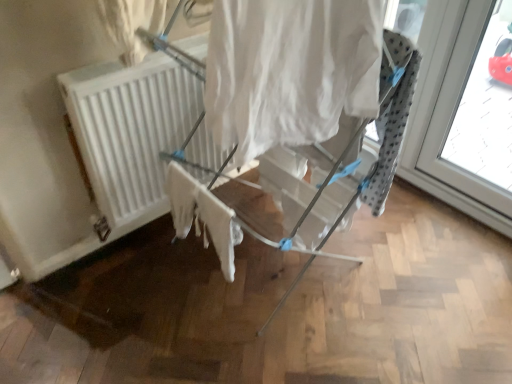
Measure the distance between white fabric curtain at center and camera.

white fabric curtain at center is 25.12 inches from camera.

Locate an element on the screen. The image size is (512, 384). white fabric curtain at center is located at coordinates (290, 70).

You are a GUI agent. You are given a task and a screenshot of the screen. Output one action in this format:
    pyautogui.click(x=<x>, y=<y>)
    Task: Click on the transparent glass window at right
    This screenshot has width=512, height=384.
    Given the screenshot: What is the action you would take?
    pyautogui.click(x=455, y=113)

Describe the element at coordinates (383, 135) in the screenshot. This screenshot has height=384, width=512. I see `white fabric drying rack at center` at that location.

At what (x,y) coordinates should I click in order to perform the action: click on white fabric drying rack at center. Please return your answer as a coordinate pair (x, y). Looking at the image, I should click on (383, 135).

At what (x,y) coordinates should I click in order to perform the action: click on white fabric curtain at center. Please return your answer as a coordinate pair (x, y). This screenshot has width=512, height=384. Looking at the image, I should click on (290, 70).

Considering the sizes of objects white fabric curtain at center and white fabric drying rack at center in the image provided, who is wider, white fabric curtain at center or white fabric drying rack at center?

Wider between the two is white fabric drying rack at center.

Is white fabric curtain at center further to the viewer compared to white fabric drying rack at center?

That is False.

Are white fabric curtain at center and white fabric drying rack at center far apart?

No, white fabric curtain at center is not far from white fabric drying rack at center.

From a real-world perspective, which object rests below the other?

From a 3D spatial view, white fabric drying rack at center is below.

Which of these two, white fabric drying rack at center or transparent glass window at right, is bigger?

Bigger between the two is white fabric drying rack at center.

In the scene shown: Considering their positions, is white fabric drying rack at center located in front of or behind transparent glass window at right?

Clearly, white fabric drying rack at center is in front of transparent glass window at right.

How different are the orientations of white fabric drying rack at center and transparent glass window at right in degrees?

The angle between the facing direction of white fabric drying rack at center and the facing direction of transparent glass window at right is 89.3 degrees.

Consider the image. Is white fabric drying rack at center beside transparent glass window at right?

white fabric drying rack at center is not next to transparent glass window at right, and they're not touching.

From the image's perspective, is white matte radiator at center over white cotton cloth at center?

Yes, from the image's perspective, white matte radiator at center is above white cotton cloth at center.

Looking at their sizes, would you say white matte radiator at center is wider or thinner than white cotton cloth at center?

In the image, white matte radiator at center appears to be more narrow than white cotton cloth at center.

Choose the correct answer: Is white matte radiator at center inside white cotton cloth at center or outside it?

white matte radiator at center is spatially situated outside white cotton cloth at center.

Who is bigger, white matte radiator at center or white cotton cloth at center?

white matte radiator at center is bigger.

Is transparent glass window at right a part of white fabric curtain at center?

No, transparent glass window at right is located outside of white fabric curtain at center.

Is white fabric curtain at center at the left side of transparent glass window at right?

Yes.

Locate an element on the screen. window that appears behind the white fabric curtain at center is located at coordinates (455, 113).

From a real-world perspective, between white cotton cloth at center and white fabric curtain at center, who is vertically higher?

white fabric curtain at center is physically above.

Can you tell me how much white cotton cloth at center and white fabric curtain at center differ in facing direction?

The angle between the facing direction of white cotton cloth at center and the facing direction of white fabric curtain at center is 3.19 degrees.

Is white cotton cloth at center oriented away from white fabric curtain at center?

No, white fabric curtain at center is not at the back of white cotton cloth at center.

In the image, is white cotton cloth at center positioned in front of or behind white fabric curtain at center?

Clearly, white cotton cloth at center is behind white fabric curtain at center.

This screenshot has width=512, height=384. In order to click on window above the white fabric drying rack at center (from the image's perspective) in this screenshot , I will do `click(455, 113)`.

Is transparent glass window at right at the left side of white fabric drying rack at center?

Incorrect, transparent glass window at right is not on the left side of white fabric drying rack at center.

From the image's perspective, between transparent glass window at right and white fabric drying rack at center, who is located below?

white fabric drying rack at center.

Is transparent glass window at right not within white fabric drying rack at center?

transparent glass window at right lies outside white fabric drying rack at center's area.

Is white fabric curtain at center in front of white cotton cloth at center?

Yes, white fabric curtain at center is closer to the camera.

Considering the relative positions of white fabric curtain at center and white cotton cloth at center in the image provided, is white fabric curtain at center to the left of white cotton cloth at center from the viewer's perspective?

In fact, white fabric curtain at center is to the right of white cotton cloth at center.

From the image's perspective, is white fabric curtain at center below white cotton cloth at center?

No.

Identify the location of furniture that appears below the white fabric curtain at center (from a real-world perspective). (383, 135).

Where is `furniture on the left of the transparent glass window at right`? This screenshot has width=512, height=384. furniture on the left of the transparent glass window at right is located at coordinates (383, 135).

Based on their spatial positions, is transparent glass window at right or white matte radiator at center closer to white cotton cloth at center?

The object closer to white cotton cloth at center is white matte radiator at center.

Based on their spatial positions, is white matte radiator at center or transparent glass window at right closer to white fabric drying rack at center?

Based on the image, white matte radiator at center appears to be nearer to white fabric drying rack at center.

Which object lies further to the anchor point white matte radiator at center, white fabric curtain at center or white cotton cloth at center?

white fabric curtain at center lies further to white matte radiator at center than the other object.

From the picture: When comparing their distances from white fabric drying rack at center, does transparent glass window at right or white fabric curtain at center seem closer?

Among the two, white fabric curtain at center is located nearer to white fabric drying rack at center.

Estimate the real-world distances between objects in this image. Which object is further from transparent glass window at right, white fabric drying rack at center or white matte radiator at center?

The object further to transparent glass window at right is white matte radiator at center.

Which object lies further to the anchor point white cotton cloth at center, white fabric drying rack at center or white matte radiator at center?

The object further to white cotton cloth at center is white matte radiator at center.

Considering their positions, is white cotton cloth at center positioned further to white fabric drying rack at center than white fabric curtain at center?

Based on the image, white fabric curtain at center appears to be further to white fabric drying rack at center.

Based on their spatial positions, is white fabric drying rack at center or white cotton cloth at center closer to transparent glass window at right?

Based on the image, white fabric drying rack at center appears to be nearer to transparent glass window at right.

Find the location of a particular element. fabric between white fabric drying rack at center and white matte radiator at center from front to back is located at coordinates (202, 215).

Locate an element on the screen. furniture located between white fabric curtain at center and white matte radiator at center in the depth direction is located at coordinates (x=383, y=135).

Identify the location of furniture between white cotton cloth at center and transparent glass window at right. (383, 135).

The width and height of the screenshot is (512, 384). I want to click on curtain situated between white matte radiator at center and transparent glass window at right from left to right, so click(x=290, y=70).